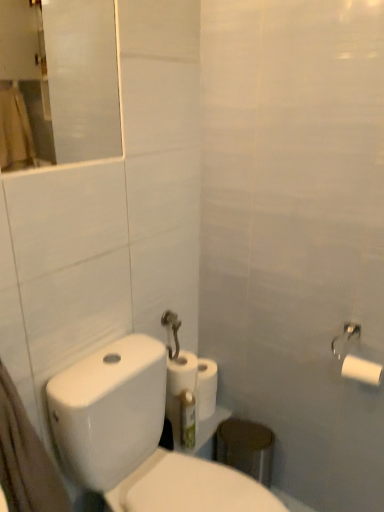
Question: Does white matte paper towel at center have a larger size compared to white matte toilet paper at upper right, arranged as the 2th toilet paper when viewed from the front?

Choices:
 (A) yes
 (B) no

Answer: (A)

Question: Is white matte paper towel at center not inside white matte toilet paper at upper right, placed as the 2th toilet paper when sorted from back to front?

Choices:
 (A) no
 (B) yes

Answer: (B)

Question: From the image's perspective, would you say white matte paper towel at center is shown under white matte toilet paper at upper right, the first toilet paper in the right-to-left sequence?

Choices:
 (A) no
 (B) yes

Answer: (B)

Question: Is white matte paper towel at center oriented towards white matte toilet paper at upper right, arranged as the 2th toilet paper when viewed from the front?

Choices:
 (A) yes
 (B) no

Answer: (B)

Question: Considering the relative sizes of white matte paper towel at center and white matte toilet paper at upper right, the first toilet paper in the right-to-left sequence, in the image provided, is white matte paper towel at center wider than white matte toilet paper at upper right, the first toilet paper in the right-to-left sequence,?

Choices:
 (A) yes
 (B) no

Answer: (A)

Question: Considering the positions of transparent glass mirror at upper left and white matte paper towel at center in the image, is transparent glass mirror at upper left taller or shorter than white matte paper towel at center?

Choices:
 (A) short
 (B) tall

Answer: (B)

Question: Is transparent glass mirror at upper left bigger or smaller than white matte paper towel at center?

Choices:
 (A) big
 (B) small

Answer: (A)

Question: In terms of width, does transparent glass mirror at upper left look wider or thinner when compared to white matte paper towel at center?

Choices:
 (A) thin
 (B) wide

Answer: (A)

Question: In the image, is transparent glass mirror at upper left positioned in front of or behind white matte paper towel at center?

Choices:
 (A) behind
 (B) front

Answer: (B)

Question: Is white matte toilet paper at right, which is counted as the 2th toilet paper, starting from the left, in front of or behind transparent glass mirror at upper left in the image?

Choices:
 (A) behind
 (B) front

Answer: (A)

Question: In the image, is white matte toilet paper at right, which is counted as the 2th toilet paper, starting from the left, on the left side or the right side of transparent glass mirror at upper left?

Choices:
 (A) left
 (B) right

Answer: (B)

Question: Considering the positions of white matte toilet paper at right, positioned as the 3th toilet paper in back-to-front order, and transparent glass mirror at upper left in the image, is white matte toilet paper at right, positioned as the 3th toilet paper in back-to-front order, wider or thinner than transparent glass mirror at upper left?

Choices:
 (A) wide
 (B) thin

Answer: (A)

Question: Is white matte toilet paper at right, the first toilet paper viewed from the front, taller or shorter than transparent glass mirror at upper left?

Choices:
 (A) short
 (B) tall

Answer: (A)

Question: From a real-world perspective, is transparent glass mirror at upper left above or below white matte toilet paper at center, which is the first toilet paper from back to front?

Choices:
 (A) above
 (B) below

Answer: (A)

Question: Is point (36, 96) positioned closer to the camera than point (187, 366)?

Choices:
 (A) farther
 (B) closer

Answer: (A)